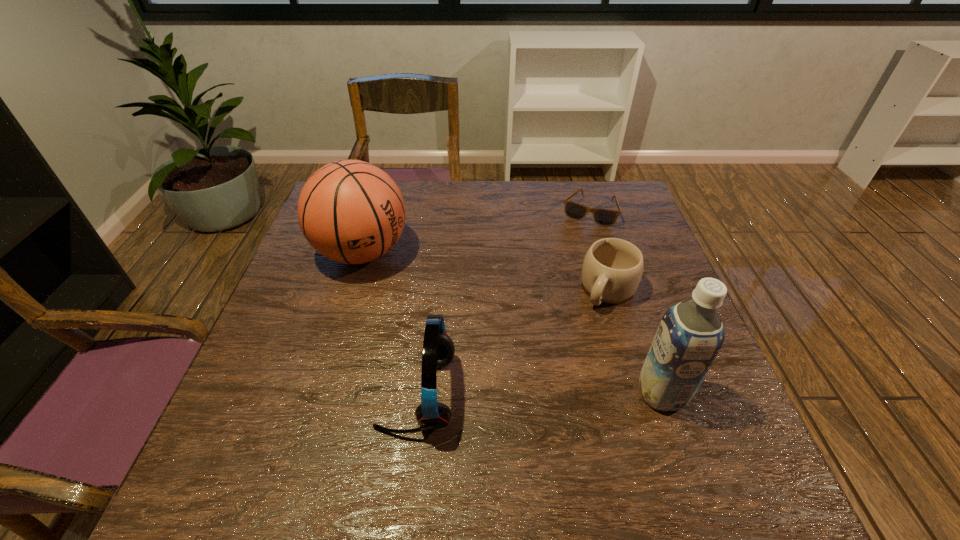
Locate an element on the screen. Image resolution: width=960 pixels, height=540 pixels. sunglasses that is at the far edge is located at coordinates (605, 217).

I want to click on basketball positioned at the far edge, so click(x=350, y=211).

Find the location of a particular element. headset present at the near edge is located at coordinates (438, 349).

You are a GUI agent. You are given a task and a screenshot of the screen. Output one action in this format:
    pyautogui.click(x=<x>, y=<y>)
    Task: Click on the soya milk that is positioned at the near edge
    The height and width of the screenshot is (540, 960).
    Given the screenshot: What is the action you would take?
    pyautogui.click(x=690, y=335)

You are a GUI agent. You are given a task and a screenshot of the screen. Output one action in this format:
    pyautogui.click(x=<x>, y=<y>)
    Task: Click on the object that is at the left edge
    
    Given the screenshot: What is the action you would take?
    pyautogui.click(x=350, y=211)

At what (x,y) coordinates should I click in order to perform the action: click on soya milk present at the right edge. Please return your answer as a coordinate pair (x, y). Image resolution: width=960 pixels, height=540 pixels. Looking at the image, I should click on (690, 335).

At what (x,y) coordinates should I click in order to perform the action: click on sunglasses that is at the right edge. Please return your answer as a coordinate pair (x, y). This screenshot has width=960, height=540. Looking at the image, I should click on click(x=605, y=217).

Where is `mug present at the right edge`? mug present at the right edge is located at coordinates (612, 269).

Find the location of a particular element. This screenshot has width=960, height=540. object that is at the far left corner is located at coordinates (350, 211).

What are the coordinates of `object situated at the far right corner` in the screenshot? It's located at (605, 217).